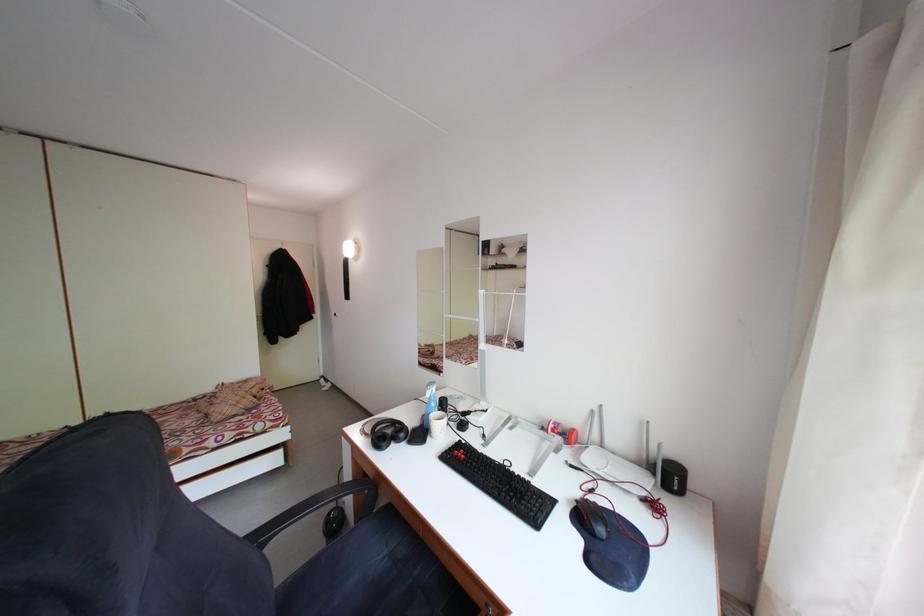
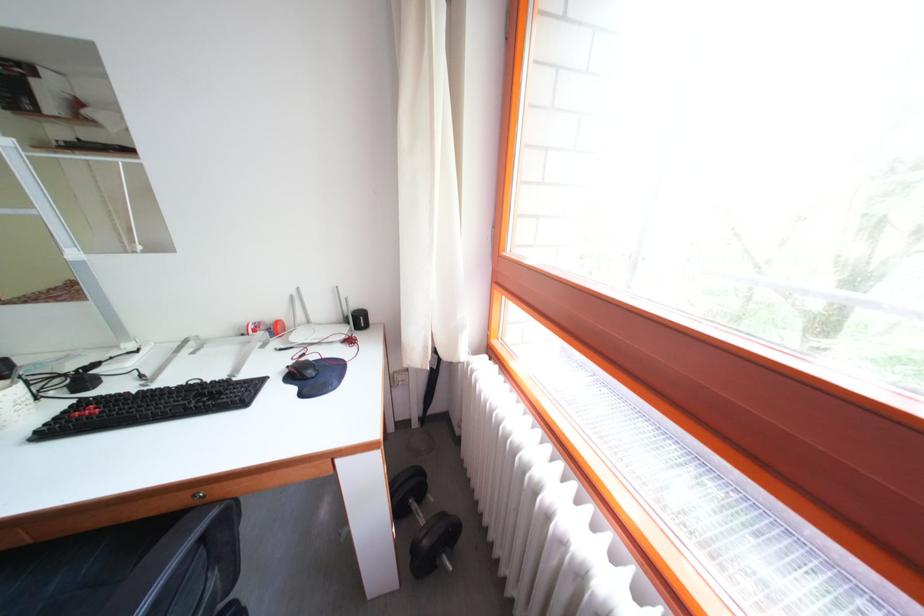
Where in the second image is the point corresponding to pixel 678 460 from the first image?

(365, 312)